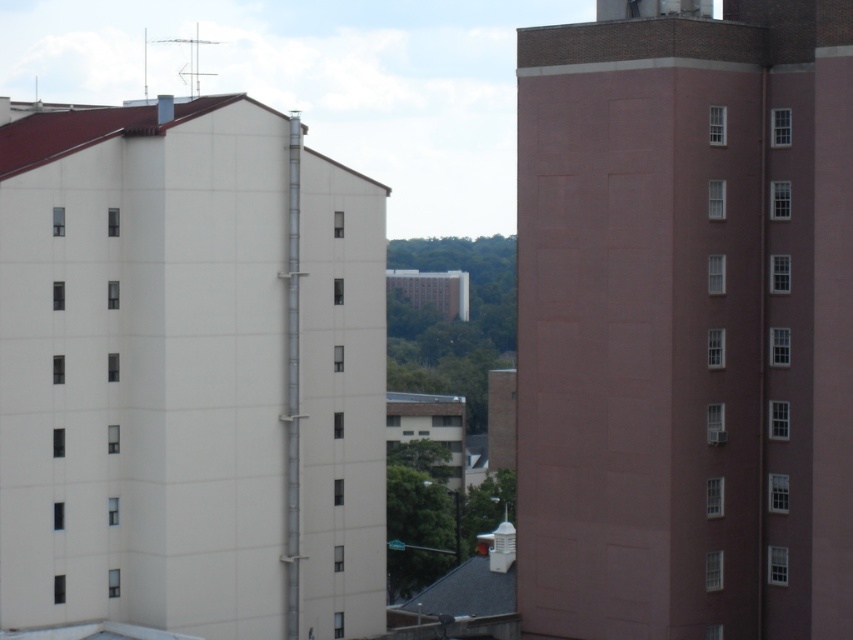
Identify the location of smooth pink building at right. The width and height of the screenshot is (853, 640). (685, 321).

Does smooth pink building at right have a greater height compared to white smooth building at left?

Yes.

Does point (602, 636) come closer to viewer compared to point (160, 205)?

No.

The width and height of the screenshot is (853, 640). I want to click on smooth pink building at right, so click(x=685, y=321).